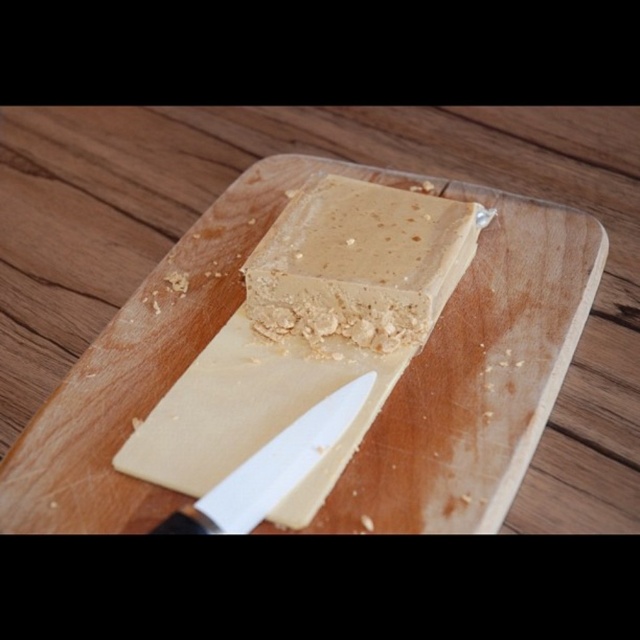
You are a chef holding a 1.5 meter long rolling pin. You need to place it on the wooden cutting board at center without it hanging off the edge. Is the rolling pin too long to fit on the board?

The wooden cutting board at center is 1.20 meters away from the camera. Since the rolling pin is 1.5 meters long, it is longer than the distance from the board to the camera, so placing it diagonally might cause part of it to hang off the edge. Therefore, the rolling pin is too long to fit entirely on the wooden cutting board at center.

You are a chef holding a 1.5 meter long pole. You want to reach a point that is exactly at the position of point (371, 211). Can you reach that point with your pole?

The distance of point (371, 211) from camera is 1.41 meters, so the chef can reach the point with the pole since it is shorter than the pole length.